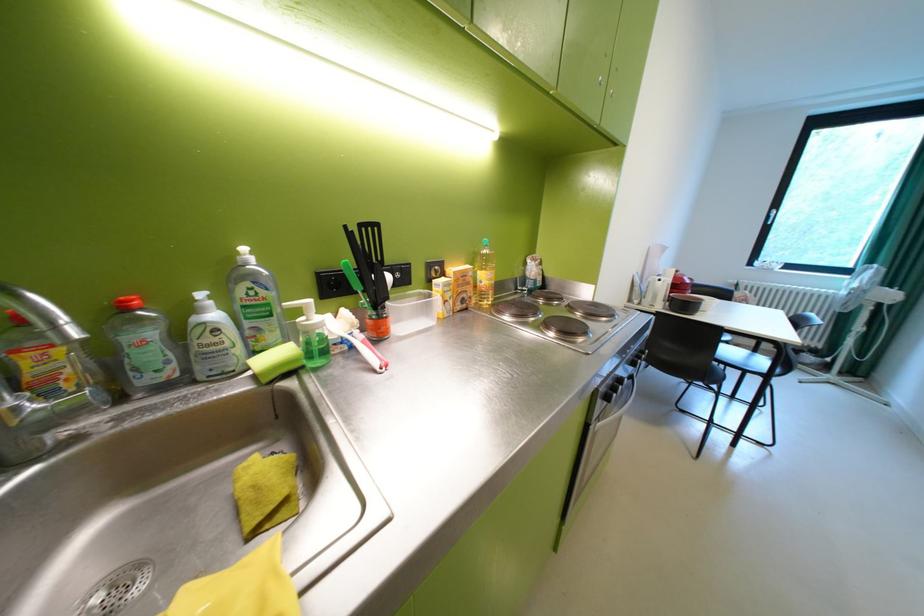
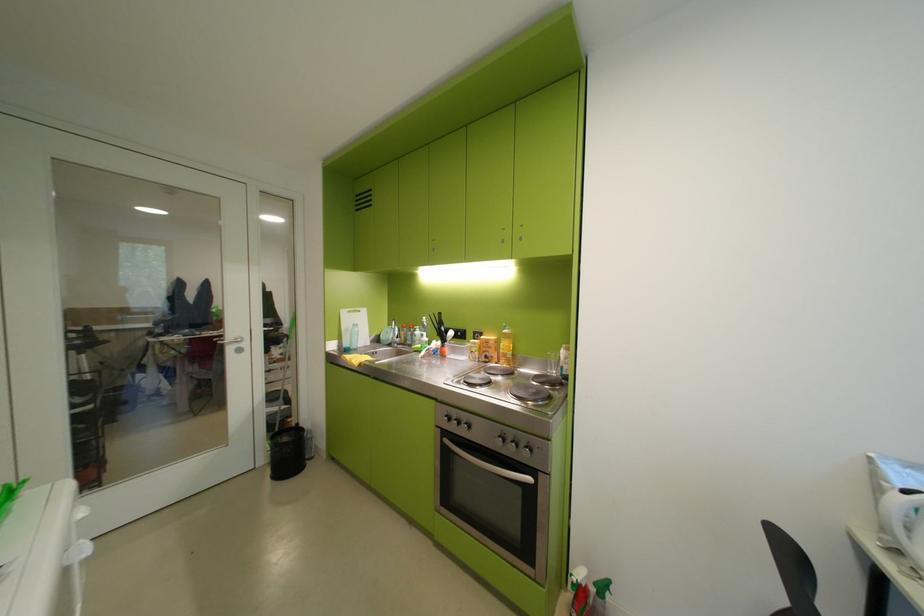
In the second image, find the point that corresponds to point 479,284 in the first image.

(501, 349)